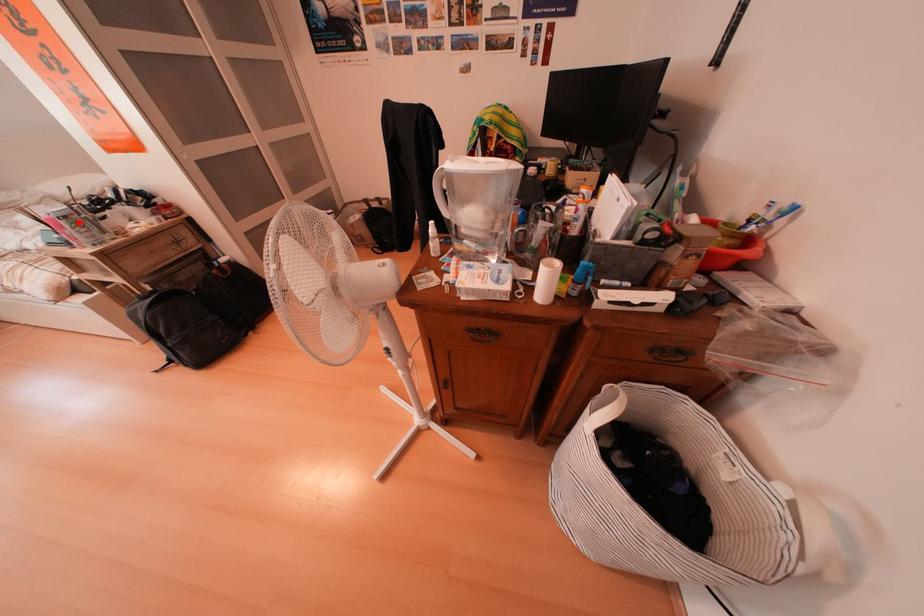
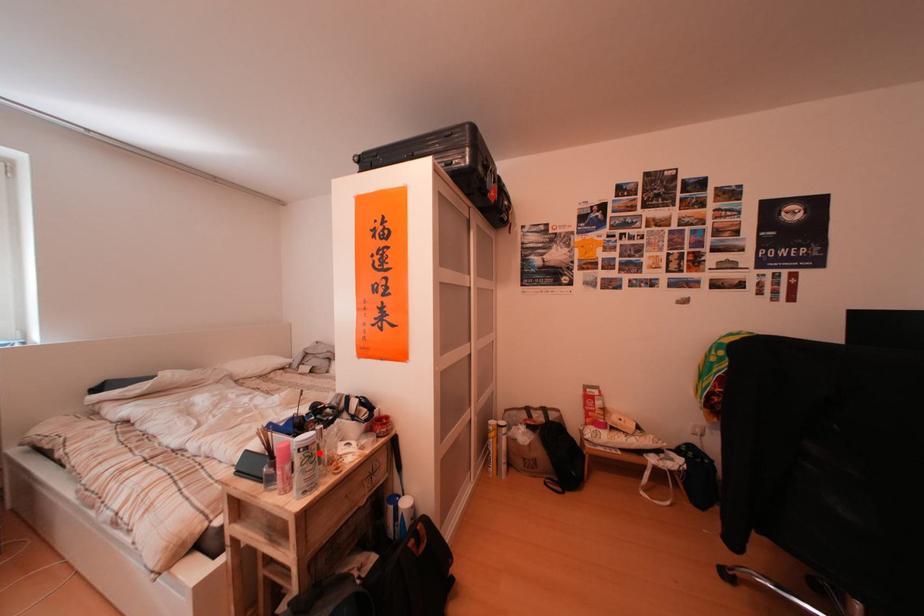
I am providing you with two images of the same scene from different viewpoints. A red point is marked on the first image and another point is marked on the second image. Is the marked point in image1 the same physical position as the marked point in image2?

Yes